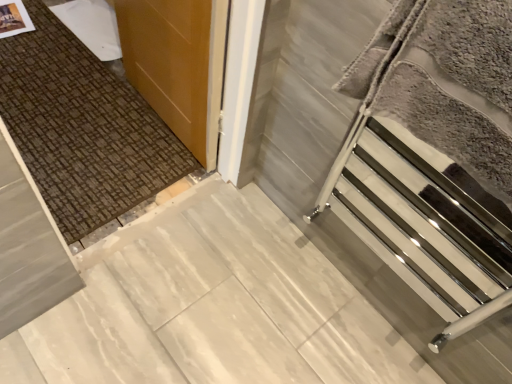
Image resolution: width=512 pixels, height=384 pixels. I want to click on blank space above white marble concrete at center (from a real-world perspective), so click(204, 312).